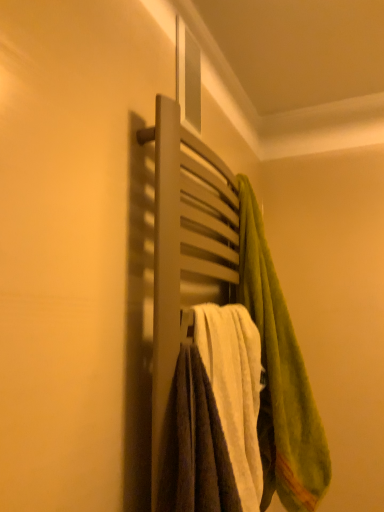
Question: Is matte wooden towel rack at center completely or partially outside of green fuzzy towel at upper right, acting as the 1th towel starting from the right?

Choices:
 (A) no
 (B) yes

Answer: (B)

Question: From the image's perspective, is matte wooden towel rack at center located beneath green fuzzy towel at upper right, acting as the 1th towel starting from the right?

Choices:
 (A) yes
 (B) no

Answer: (B)

Question: Is matte wooden towel rack at center surrounding green fuzzy towel at upper right, acting as the second towel starting from the left?

Choices:
 (A) no
 (B) yes

Answer: (A)

Question: Is matte wooden towel rack at center taller than green fuzzy towel at upper right, acting as the 1th towel starting from the right?

Choices:
 (A) no
 (B) yes

Answer: (A)

Question: Could you tell me if matte wooden towel rack at center is facing green fuzzy towel at upper right, acting as the 1th towel starting from the right?

Choices:
 (A) no
 (B) yes

Answer: (B)

Question: Considering the relative sizes of matte wooden towel rack at center and green fuzzy towel at upper right, acting as the second towel starting from the left, in the image provided, is matte wooden towel rack at center wider than green fuzzy towel at upper right, acting as the second towel starting from the left,?

Choices:
 (A) yes
 (B) no

Answer: (B)

Question: Can you confirm if white soft towel at center, marked as the first towel in a left-to-right arrangement, is taller than green fuzzy towel at upper right, acting as the second towel starting from the left?

Choices:
 (A) yes
 (B) no

Answer: (B)

Question: Does white soft towel at center, marked as the first towel in a left-to-right arrangement, lie in front of green fuzzy towel at upper right, acting as the second towel starting from the left?

Choices:
 (A) no
 (B) yes

Answer: (B)

Question: Could you tell me if white soft towel at center, acting as the 2th towel starting from the right, is facing green fuzzy towel at upper right, acting as the 1th towel starting from the right?

Choices:
 (A) no
 (B) yes

Answer: (A)

Question: Is white soft towel at center, marked as the first towel in a left-to-right arrangement, thinner than green fuzzy towel at upper right, acting as the second towel starting from the left?

Choices:
 (A) no
 (B) yes

Answer: (B)

Question: Considering the relative positions of white soft towel at center, acting as the 2th towel starting from the right, and green fuzzy towel at upper right, acting as the second towel starting from the left, in the image provided, is white soft towel at center, acting as the 2th towel starting from the right, to the right of green fuzzy towel at upper right, acting as the second towel starting from the left, from the viewer's perspective?

Choices:
 (A) yes
 (B) no

Answer: (B)

Question: Can you confirm if white soft towel at center, acting as the 2th towel starting from the right, is wider than green fuzzy towel at upper right, acting as the second towel starting from the left?

Choices:
 (A) no
 (B) yes

Answer: (A)

Question: Is the depth of green fuzzy towel at upper right, acting as the second towel starting from the left, less than that of matte wooden towel rack at center?

Choices:
 (A) yes
 (B) no

Answer: (B)